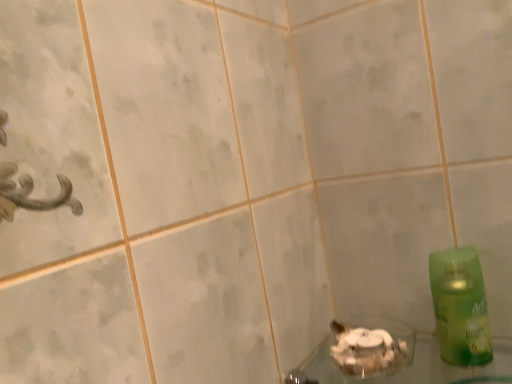
Question: From a real-world perspective, is clear glass bowl at lower center above or below green plastic bottle at right?

Choices:
 (A) above
 (B) below

Answer: (B)

Question: Is clear glass bowl at lower center inside the boundaries of green plastic bottle at right, or outside?

Choices:
 (A) inside
 (B) outside

Answer: (B)

Question: Is clear glass bowl at lower center in front of or behind green plastic bottle at right in the image?

Choices:
 (A) behind
 (B) front

Answer: (B)

Question: From a real-world perspective, is green plastic bottle at right physically located above or below clear glass bowl at lower center?

Choices:
 (A) below
 (B) above

Answer: (B)

Question: Does point (487, 327) appear closer or farther from the camera than point (501, 372)?

Choices:
 (A) closer
 (B) farther

Answer: (A)

Question: Considering the positions of green plastic bottle at right and clear glass bowl at lower center in the image, is green plastic bottle at right taller or shorter than clear glass bowl at lower center?

Choices:
 (A) short
 (B) tall

Answer: (B)

Question: From the image's perspective, is green plastic bottle at right above or below clear glass bowl at lower center?

Choices:
 (A) below
 (B) above

Answer: (B)